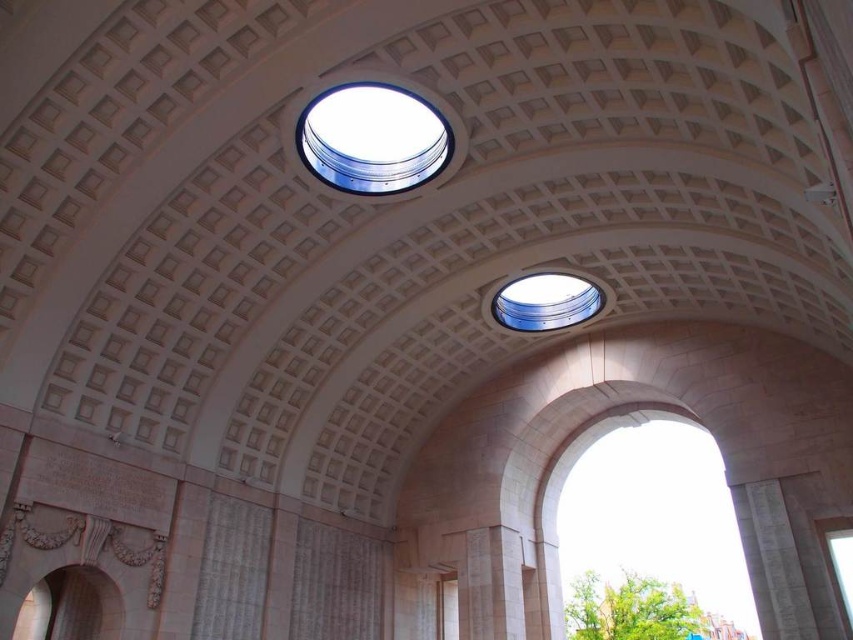
You are an architect visiting this historical site. You notice the clear glass dome at upper center and the transparent glass window at center. Which of these two glass features is positioned higher in the structure?

The clear glass dome at upper center is located above the transparent glass window at center, so it is positioned higher in the structure.

You are an architect evaluating the lighting in this space. You notice the clear glass dome at upper center and the transparent glass window at center. Which of these two objects has a smaller width?

The clear glass dome at upper center has a lesser width compared to the transparent glass window at center.